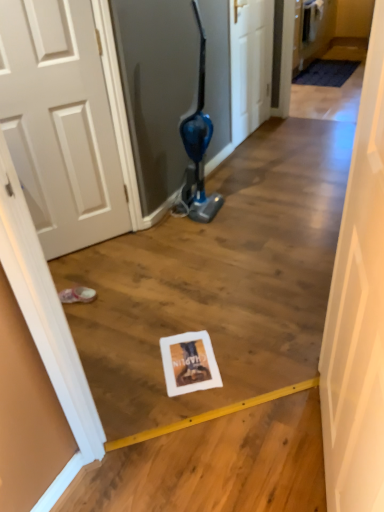
Find the location of a particular element. The height and width of the screenshot is (512, 384). vacant space in front of pink fabric footwear at lower left is located at coordinates (85, 321).